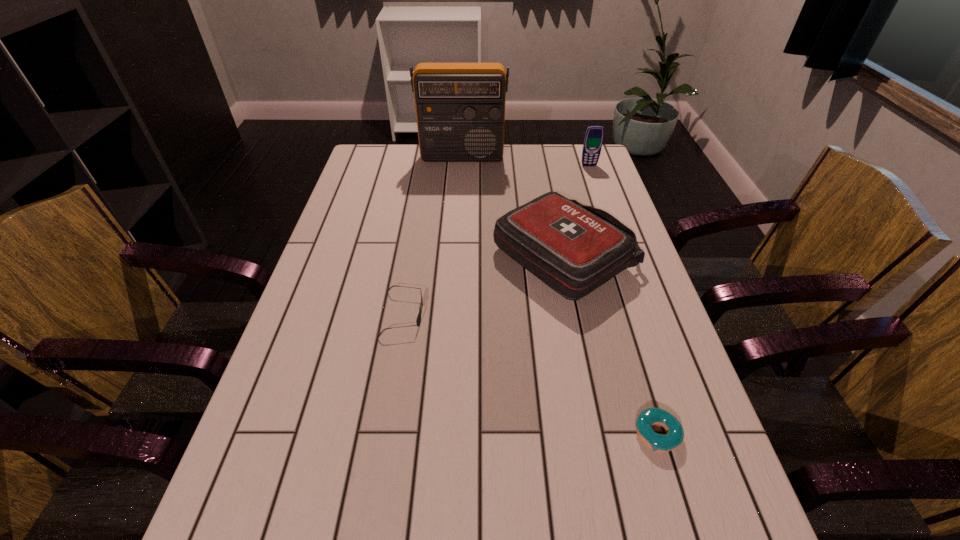
Locate which object ranks in proximity to the first-aid kit. Please provide its 2D coordinates. Your answer should be formatted as a tuple, i.e. [(x, y)], where the tuple contains the x and y coordinates of a point satisfying the conditions above.

[(418, 321)]

Image resolution: width=960 pixels, height=540 pixels. What are the coordinates of `free spot that satisfies the following two spatial constraints: 1. on the lenses of the fourth tallest object; 2. on the right side of the doughnut` in the screenshot? It's located at (383, 434).

I want to click on vacant area that satisfies the following two spatial constraints: 1. on the lenses of the sunglasses; 2. on the right side of the nearest object, so click(383, 434).